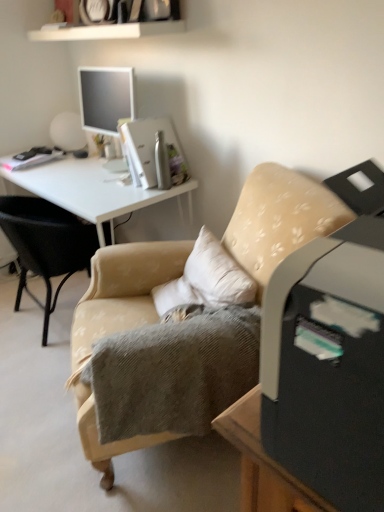
Question: Would you say beige fabric chair at center, marked as the second chair in a left-to-right arrangement, is to the left or to the right of white glossy desk at upper left in the picture?

Choices:
 (A) right
 (B) left

Answer: (A)

Question: In terms of width, does beige fabric chair at center, marked as the second chair in a left-to-right arrangement, look wider or thinner when compared to white glossy desk at upper left?

Choices:
 (A) wide
 (B) thin

Answer: (A)

Question: Which object is the farthest from the beige fabric chair at center, which appears as the 2th chair when viewed from the right?

Choices:
 (A) beige fabric chair at center, which ranks as the 1th chair in right-to-left order
 (B) white glossy desk at upper left

Answer: (A)

Question: Estimate the real-world distances between objects in this image. Which object is closer to the white glossy desk at upper left?

Choices:
 (A) beige fabric chair at center, which ranks as the first chair in left-to-right order
 (B) beige fabric chair at center, which ranks as the 1th chair in right-to-left order

Answer: (A)